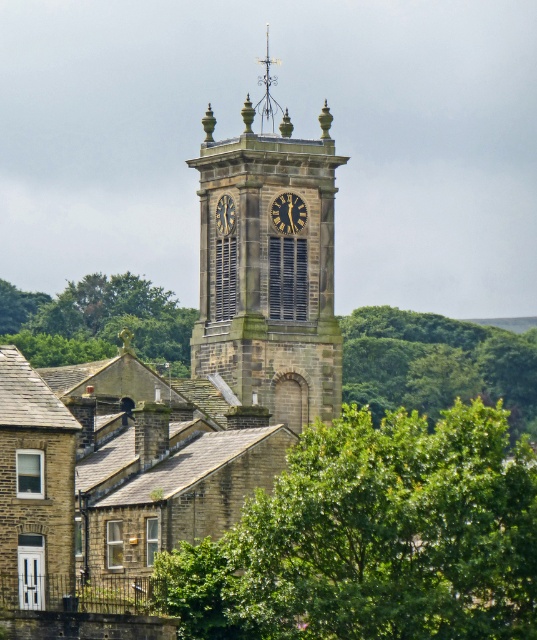
Between stone clock tower at center and dark gray stone clock at center, which one appears on the right side from the viewer's perspective?

From the viewer's perspective, stone clock tower at center appears more on the right side.

Who is positioned more to the left, stone clock tower at center or dark gray stone clock at center?

From the viewer's perspective, dark gray stone clock at center appears more on the left side.

Which is in front, point (199, 148) or point (228, 198)?

Point (228, 198) is in front.

What are the coordinates of `stone clock tower at center` in the screenshot? It's located at (268, 272).

Between green leafy tree at left and gold metallic clock at center, which one appears on the right side from the viewer's perspective?

From the viewer's perspective, gold metallic clock at center appears more on the right side.

Does green leafy tree at left appear over gold metallic clock at center?

Incorrect, green leafy tree at left is not positioned above gold metallic clock at center.

Locate an element on the screen. green leafy tree at left is located at coordinates tap(97, 321).

Can you confirm if green leafy tree at center is smaller than gold metallic clock at center?

No, green leafy tree at center is not smaller than gold metallic clock at center.

The width and height of the screenshot is (537, 640). Identify the location of green leafy tree at center. (437, 364).